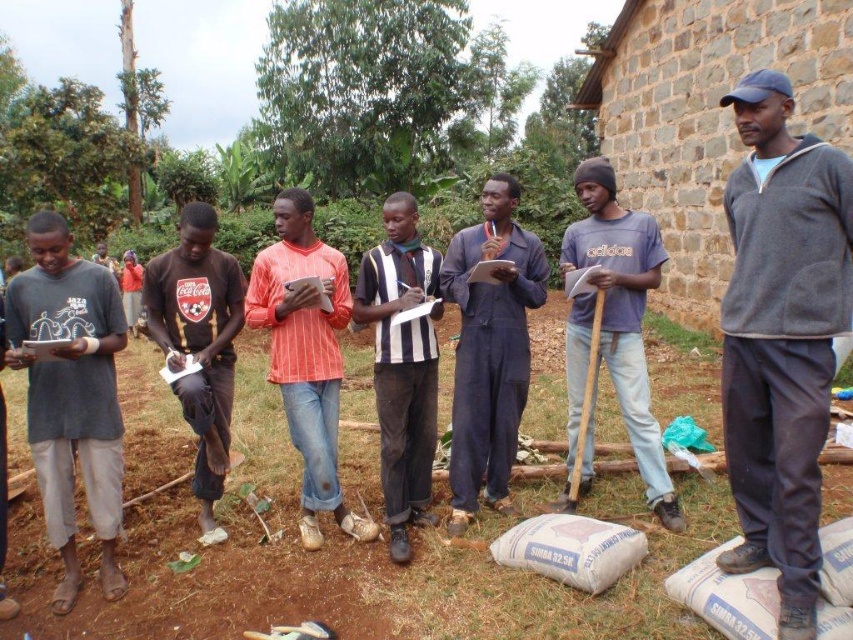
You are standing at the origin point of the coordinate system in the image. Where is the gray fleece jacket at center located in terms of its coordinates?

The gray fleece jacket at center is located at coordinates point (x=781, y=337).